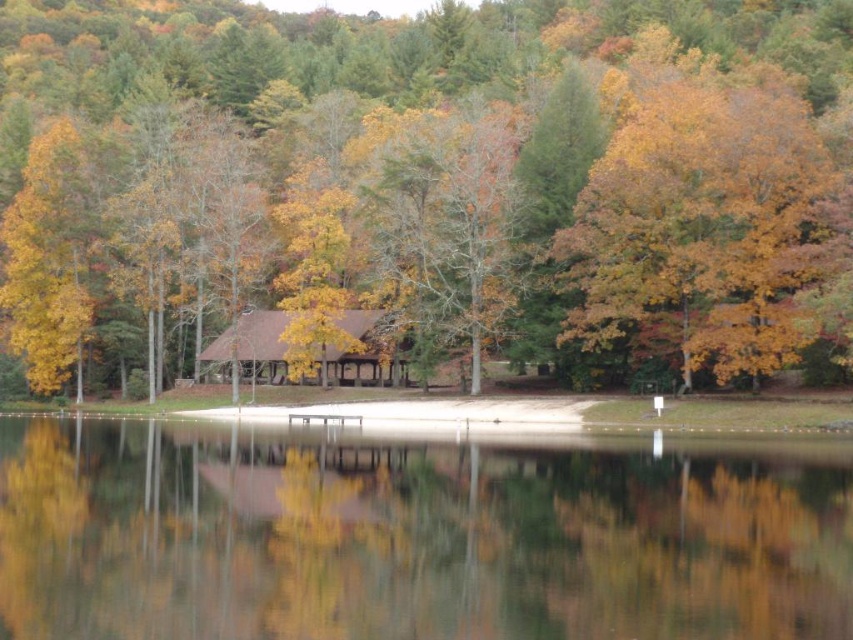
You are planning to take a photo of the yellow matte tree at center and the brown wooden cabin at center from a distance. Which object will appear wider in the photo?

The yellow matte tree at center will appear wider in the photo because its width is larger than that of the brown wooden cabin at center.